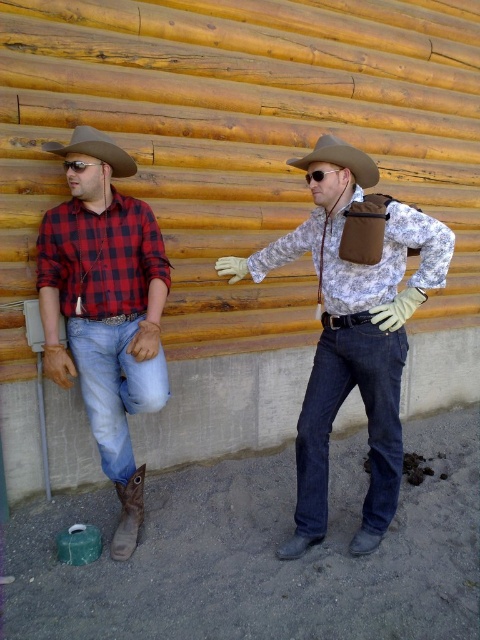
Who is positioned more to the right, dark blue denim jeans at center or brown leather cowboy hat at upper center?

dark blue denim jeans at center

Who is higher up, dark blue denim jeans at center or brown leather cowboy hat at upper center?

brown leather cowboy hat at upper center is above.

The width and height of the screenshot is (480, 640). Identify the location of dark blue denim jeans at center. (336, 412).

This screenshot has height=640, width=480. I want to click on dark blue denim jeans at center, so click(336, 412).

Is matte plaid shirt at left smaller than camouflage fabric shirt at center?

Actually, matte plaid shirt at left might be larger than camouflage fabric shirt at center.

Does point (107, 184) lie in front of point (393, 243)?

No, it is behind (393, 243).

Image resolution: width=480 pixels, height=640 pixels. I want to click on matte plaid shirt at left, so click(106, 308).

Which is more to the left, floral-patterned fabric shirt at center or matte black goggles at upper left?

From the viewer's perspective, matte black goggles at upper left appears more on the left side.

Is floral-patterned fabric shirt at center smaller than matte black goggles at upper left?

Actually, floral-patterned fabric shirt at center might be larger than matte black goggles at upper left.

Image resolution: width=480 pixels, height=640 pixels. What do you see at coordinates (352, 332) in the screenshot?
I see `floral-patterned fabric shirt at center` at bounding box center [352, 332].

In order to click on floral-patterned fabric shirt at center in this screenshot , I will do `click(352, 332)`.